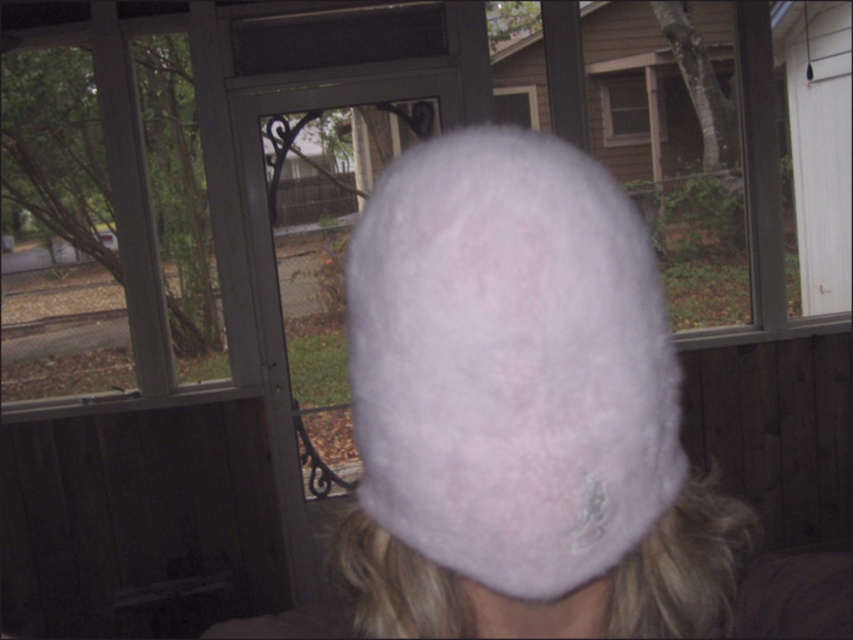
Is fuzzy pink hat at center above clear glass screen door at center?

Correct, fuzzy pink hat at center is located above clear glass screen door at center.

Is fuzzy pink hat at center bigger than clear glass screen door at center?

No.

Find the location of a particular element. This screenshot has height=640, width=853. fuzzy pink hat at center is located at coordinates (509, 362).

Identify the location of fuzzy pink hat at center. (509, 362).